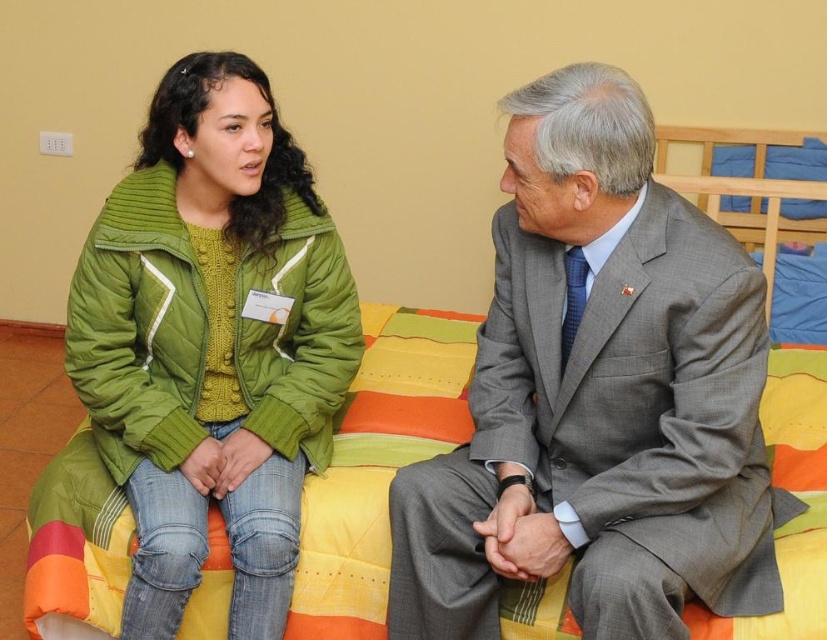
Question: Can you confirm if gray wool suit at center is thinner than green quilted jacket at upper left?

Choices:
 (A) no
 (B) yes

Answer: (A)

Question: Which point is closer to the camera?

Choices:
 (A) gray wool suit at center
 (B) green quilted jacket at upper left

Answer: (A)

Question: Is gray wool suit at center in front of green quilted jacket at upper left?

Choices:
 (A) yes
 (B) no

Answer: (A)

Question: In this image, where is gray wool suit at center located relative to green quilted jacket at upper left?

Choices:
 (A) right
 (B) left

Answer: (A)